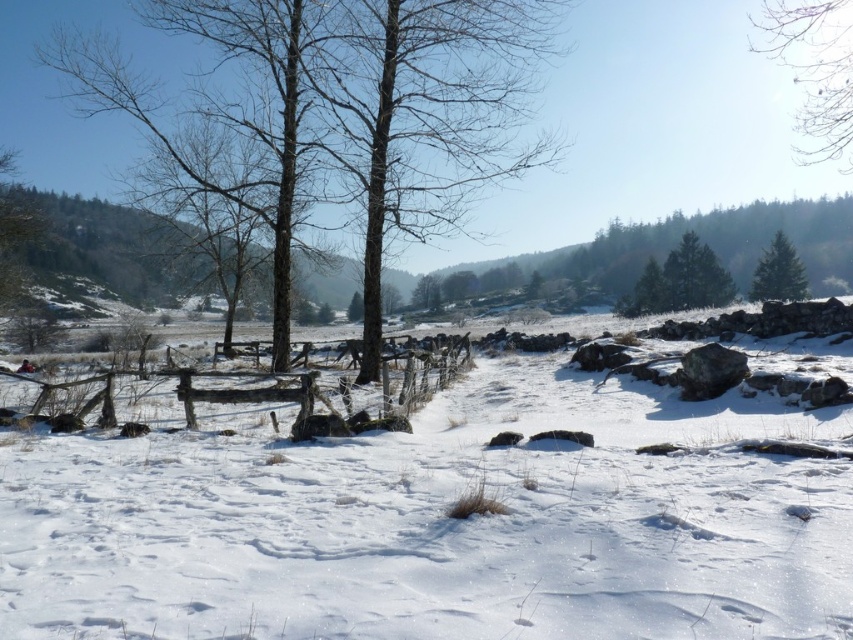
You are an artist sketching the winter scene. You want to ensure the white fluffy snow at center and the bare branches at upper right are proportionally accurate. Which object should you draw taller in your sketch?

The bare branches at upper right are taller than the white fluffy snow at center, so you should draw the bare branches at upper right taller in your sketch.

You are an artist sketching the winter landscape. You notice the bare branches at upper right and the green matte evergreen tree at upper right. Which object is positioned to the left of the other?

The bare branches at upper right are to the left of the green matte evergreen tree at upper right.